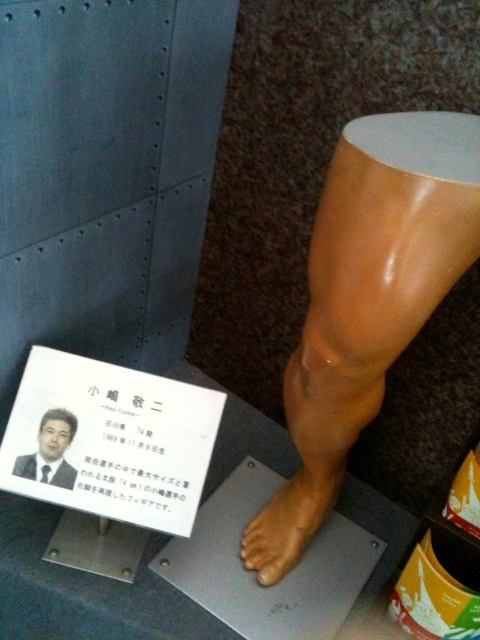
Can you confirm if matte brown foot at lower center is bigger than matte black photo frame at lower left?

Correct, matte brown foot at lower center is larger in size than matte black photo frame at lower left.

Between point (316, 465) and point (70, 483), which one is positioned behind?

Point (316, 465)

Find the location of a particular element. The height and width of the screenshot is (640, 480). matte brown foot at lower center is located at coordinates (289, 518).